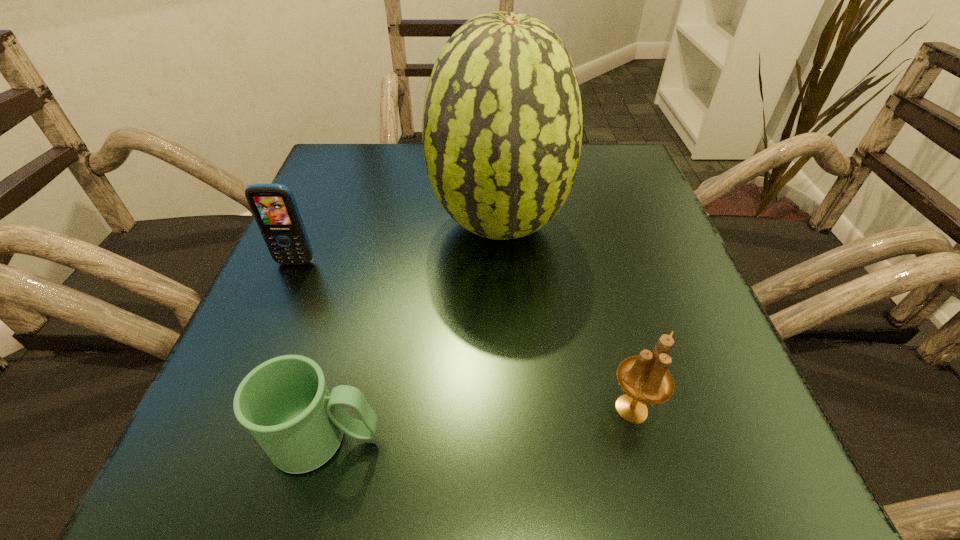
You are a GUI agent. You are given a task and a screenshot of the screen. Output one action in this format:
    pyautogui.click(x=<x>, y=<y>)
    Task: Click on the free space between the leftmost object and the candle holder
    
    Given the screenshot: What is the action you would take?
    pyautogui.click(x=464, y=336)

Locate an element on the screen. This screenshot has height=540, width=960. free area in between the candle holder and the shortest object is located at coordinates (478, 424).

I want to click on object that can be found as the closest to the cellular telephone, so click(x=502, y=126).

Locate which object ranks third in proximity to the candle holder. Please provide its 2D coordinates. Your answer should be formatted as a tuple, i.e. [(x, y)], where the tuple contains the x and y coordinates of a point satisfying the conditions above.

[(274, 207)]

Find the location of a particular element. free spot that satisfies the following two spatial constraints: 1. on the screen of the cellular telephone; 2. on the right side of the candle holder is located at coordinates (233, 409).

Locate an element on the screen. Image resolution: width=960 pixels, height=540 pixels. vacant space that satisfies the following two spatial constraints: 1. on the screen of the candle holder; 2. on the right side of the cellular telephone is located at coordinates (233, 409).

Identify the location of vacant space that satisfies the following two spatial constraints: 1. on the screen of the candle holder; 2. on the right side of the cellular telephone. The width and height of the screenshot is (960, 540). (233, 409).

This screenshot has width=960, height=540. I want to click on vacant point that satisfies the following two spatial constraints: 1. on the front side of the watermelon; 2. on the side of the third object from right to left with the handle, so click(x=509, y=439).

Where is `free space that satisfies the following two spatial constraints: 1. on the front side of the candle holder; 2. on the right side of the tallest object`? Image resolution: width=960 pixels, height=540 pixels. free space that satisfies the following two spatial constraints: 1. on the front side of the candle holder; 2. on the right side of the tallest object is located at coordinates (507, 409).